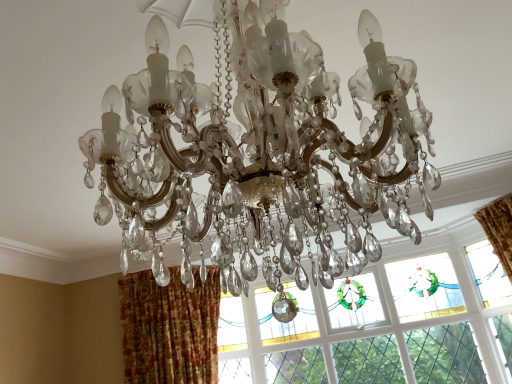
Where is `stained glass window at center`? This screenshot has width=512, height=384. stained glass window at center is located at coordinates (x=381, y=323).

Where is `clear crystal chandelier at center`? The height and width of the screenshot is (384, 512). clear crystal chandelier at center is located at coordinates (260, 150).

In terms of width, does stained glass window at center look wider or thinner when compared to textured orange curtain at lower left?

stained glass window at center is thinner than textured orange curtain at lower left.

Would you say stained glass window at center is to the left or to the right of textured orange curtain at lower left in the picture?

Clearly, stained glass window at center is on the right of textured orange curtain at lower left in the image.

Could you tell me if stained glass window at center is turned towards textured orange curtain at lower left?

Yes, stained glass window at center is aimed at textured orange curtain at lower left.

Choose the correct answer: Is stained glass window at center inside textured orange curtain at lower left or outside it?

stained glass window at center is not enclosed by textured orange curtain at lower left.

Does clear crystal chandelier at center appear on the left side of textured orange curtain at lower left?

No, clear crystal chandelier at center is not to the left of textured orange curtain at lower left.

Which object is thinner, clear crystal chandelier at center or textured orange curtain at lower left?

textured orange curtain at lower left.

How far apart are clear crystal chandelier at center and textured orange curtain at lower left?

clear crystal chandelier at center is 2.33 meters from textured orange curtain at lower left.

This screenshot has height=384, width=512. I want to click on lamp above the textured orange curtain at lower left (from a real-world perspective), so click(260, 150).

Could clear crystal chandelier at center be considered to be inside textured orange curtain at lower left?

Answer: No, clear crystal chandelier at center is located outside of textured orange curtain at lower left.

From the image's perspective, which one is positioned lower, textured orange curtain at lower left or clear crystal chandelier at center?

textured orange curtain at lower left is shown below in the image.

Is textured orange curtain at lower left at the right side of clear crystal chandelier at center?

Incorrect, textured orange curtain at lower left is not on the right side of clear crystal chandelier at center.

From a real-world perspective, relative to clear crystal chandelier at center, is textured orange curtain at lower left vertically above or below?

In terms of real-world spatial position, textured orange curtain at lower left is below clear crystal chandelier at center.

Considering the points (190, 64) and (445, 228), which point is behind, point (190, 64) or point (445, 228)?

The point (445, 228) is more distant.

Is clear crystal chandelier at center smaller than stained glass window at center?

No, clear crystal chandelier at center is not smaller than stained glass window at center.

Is clear crystal chandelier at center beside stained glass window at center?

No, clear crystal chandelier at center is not next to stained glass window at center.

Is clear crystal chandelier at center aimed at stained glass window at center?

No, clear crystal chandelier at center is not turned towards stained glass window at center.

Is point (135, 336) more distant than point (229, 294)?

No, (135, 336) is closer to viewer.

Between textured orange curtain at lower left and stained glass window at center, which one appears on the left side from the viewer's perspective?

Positioned to the left is textured orange curtain at lower left.

Could you tell me if textured orange curtain at lower left is facing stained glass window at center?

No, textured orange curtain at lower left does not turn towards stained glass window at center.

From a real-world perspective, is textured orange curtain at lower left located beneath stained glass window at center?

No, from a real-world perspective, textured orange curtain at lower left is not under stained glass window at center.

From the image's perspective, is stained glass window at center positioned above or below clear crystal chandelier at center?

stained glass window at center is situated lower than clear crystal chandelier at center in the image.

Could clear crystal chandelier at center be considered to be inside stained glass window at center?

Actually, clear crystal chandelier at center is outside stained glass window at center.

Between stained glass window at center and clear crystal chandelier at center, which one has less height?

Standing shorter between the two is clear crystal chandelier at center.

Between stained glass window at center and clear crystal chandelier at center, which one has smaller width?

stained glass window at center.

The image size is (512, 384). I want to click on curtain on the left of stained glass window at center, so click(x=170, y=328).

Where is `lamp in front of the textured orange curtain at lower left`? lamp in front of the textured orange curtain at lower left is located at coordinates (260, 150).

Considering their positions, is stained glass window at center positioned closer to clear crystal chandelier at center than textured orange curtain at lower left?

stained glass window at center.

Looking at the image, which one is located closer to textured orange curtain at lower left, clear crystal chandelier at center or stained glass window at center?

Based on the image, stained glass window at center appears to be nearer to textured orange curtain at lower left.

Estimate the real-world distances between objects in this image. Which object is further from clear crystal chandelier at center, textured orange curtain at lower left or stained glass window at center?

textured orange curtain at lower left lies further to clear crystal chandelier at center than the other object.

From the image, which object appears to be farther from textured orange curtain at lower left, stained glass window at center or clear crystal chandelier at center?

clear crystal chandelier at center is positioned further to the anchor textured orange curtain at lower left.

Considering their positions, is clear crystal chandelier at center positioned further to stained glass window at center than textured orange curtain at lower left?

clear crystal chandelier at center is positioned further to the anchor stained glass window at center.

Looking at the image, which one is located further to stained glass window at center, textured orange curtain at lower left or clear crystal chandelier at center?

clear crystal chandelier at center.

Find the location of a particular element. This screenshot has height=384, width=512. curtain between clear crystal chandelier at center and stained glass window at center along the z-axis is located at coordinates coord(170,328).